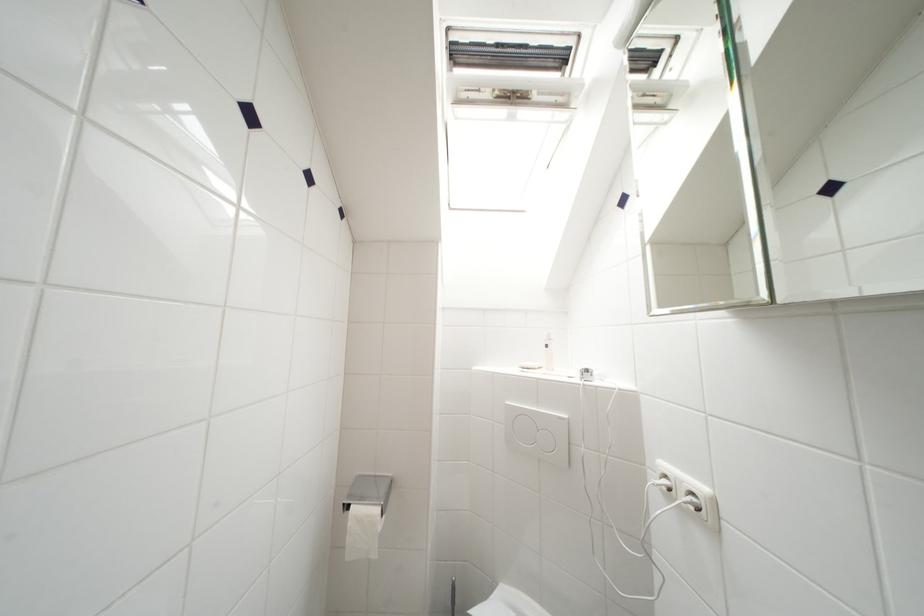
The width and height of the screenshot is (924, 616). In order to click on toilet brush handle in this screenshot , I will do `click(453, 594)`.